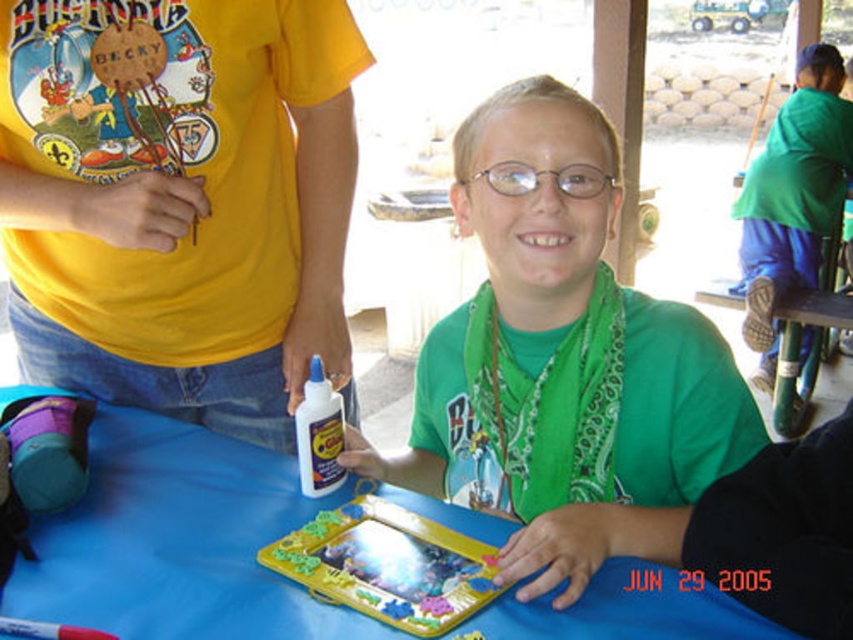
You are organizing a clothing display and need to know which item is narrower between the green matte shirt at center and the green fabric scarf at upper right. Which one should you choose?

The green matte shirt at center is narrower than the green fabric scarf at upper right, so you should choose the green matte shirt at center for the narrower item.